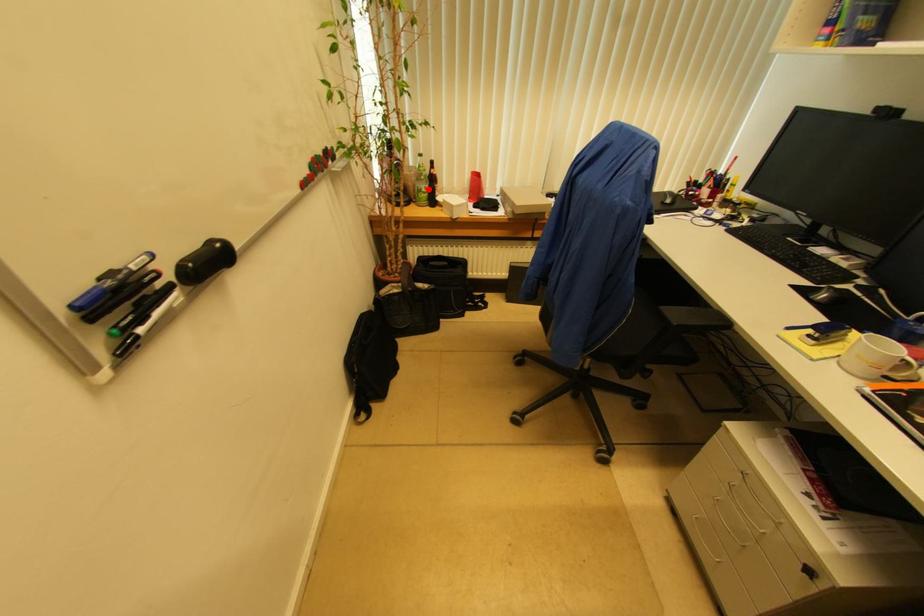
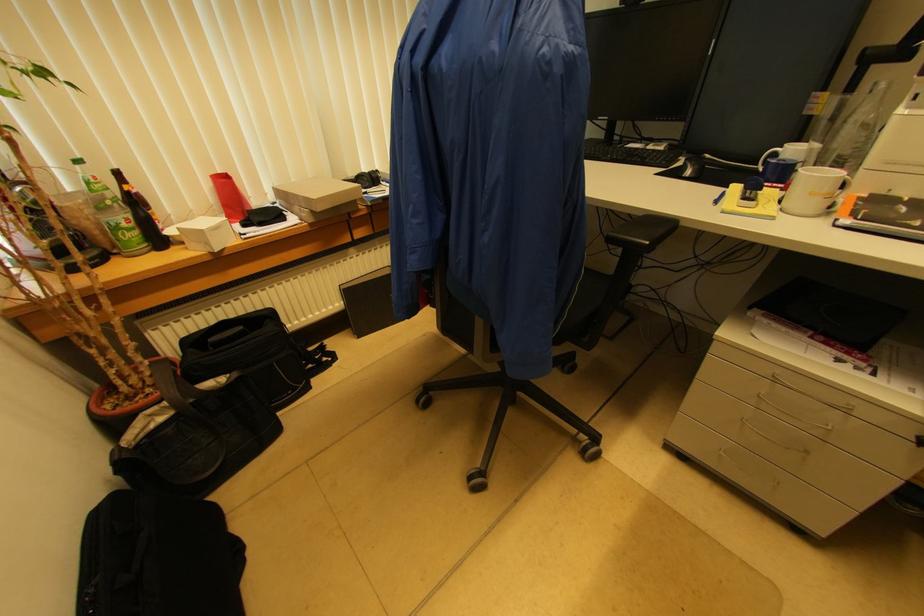
The point at the highlighted location is marked in the first image. Where is the corresponding point in the second image?

(131, 219)